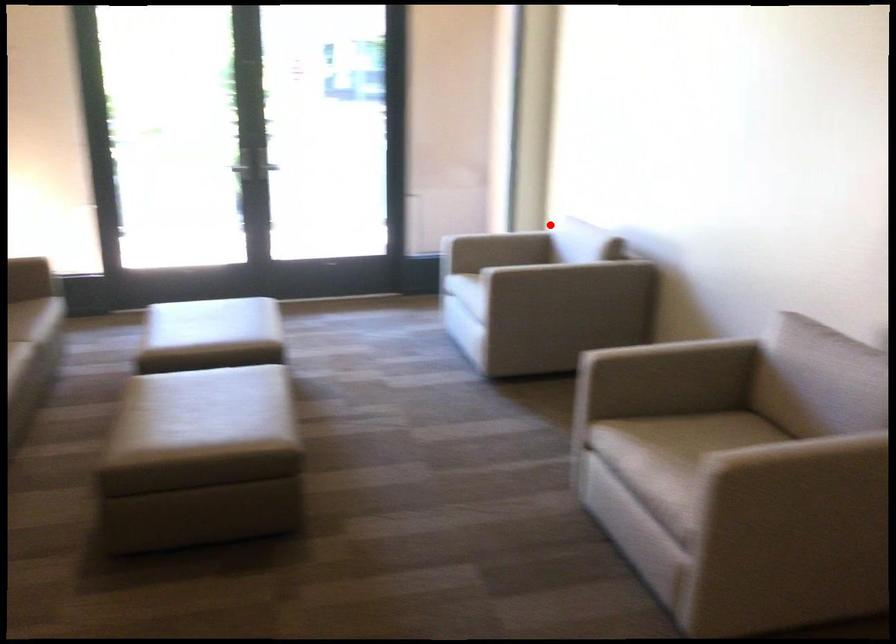
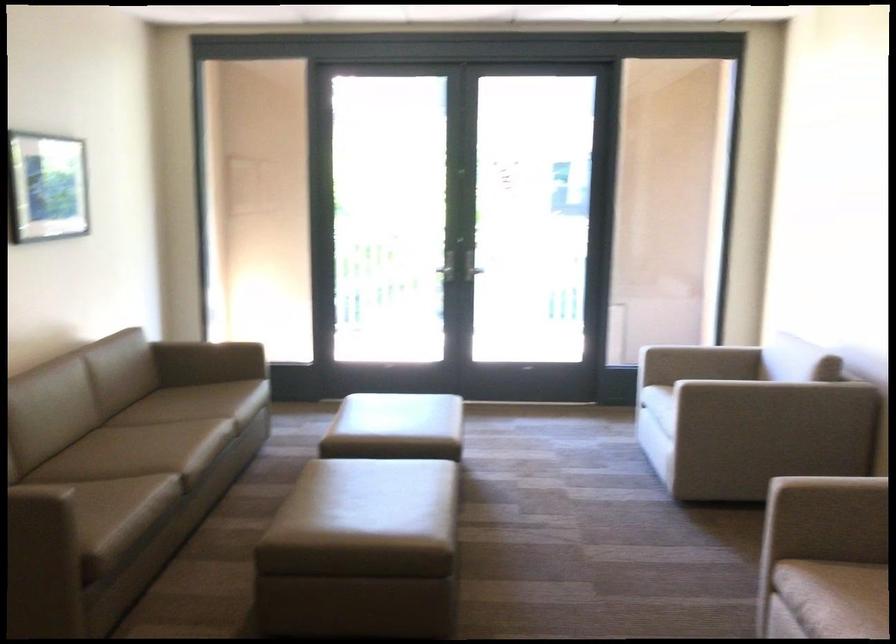
Question: I am providing you with two images of the same scene from different viewpoints. A red point is marked on the first image. Is the red point's position out of view in image 2?

Choices:
 (A) Yes
 (B) No

Answer: (B)